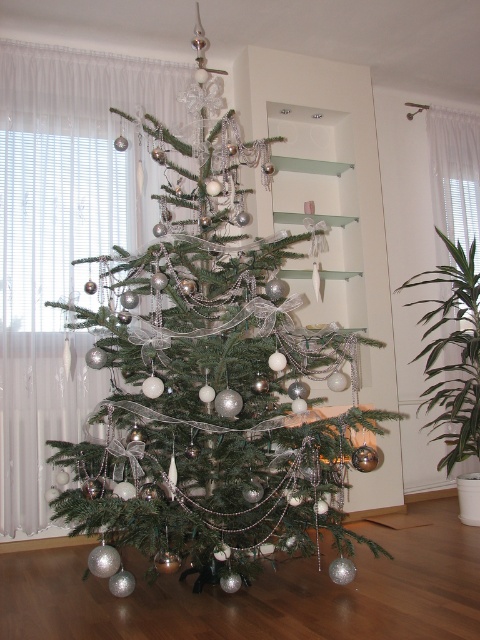
Who is positioned more to the right, shiny silver ornaments at center or green leafy plant at right?

green leafy plant at right

Which is in front, point (115, 586) or point (475, 417)?

Point (115, 586)

The height and width of the screenshot is (640, 480). What are the coordinates of `shiny silver ornaments at center` in the screenshot? It's located at (213, 378).